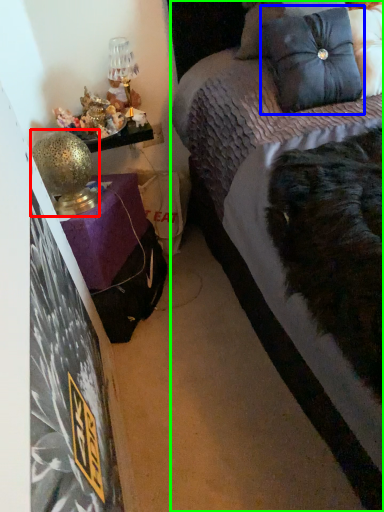
Question: Which object is positioned farthest from table lamp (highlighted by a red box)? Select from pillow (highlighted by a blue box) and bed (highlighted by a green box).

Choices:
 (A) pillow
 (B) bed

Answer: (A)